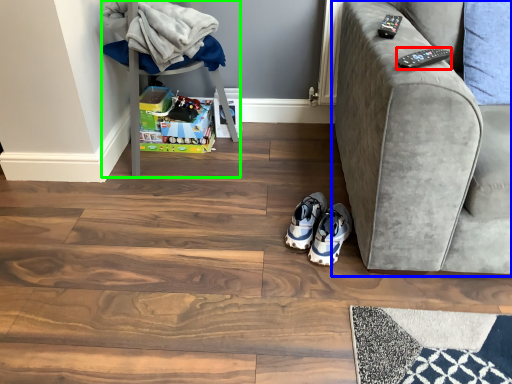
Question: Estimate the real-world distances between objects in this image. Which object is farther from remote (highlighted by a red box), studio couch (highlighted by a blue box) or furniture (highlighted by a green box)?

Choices:
 (A) studio couch
 (B) furniture

Answer: (B)